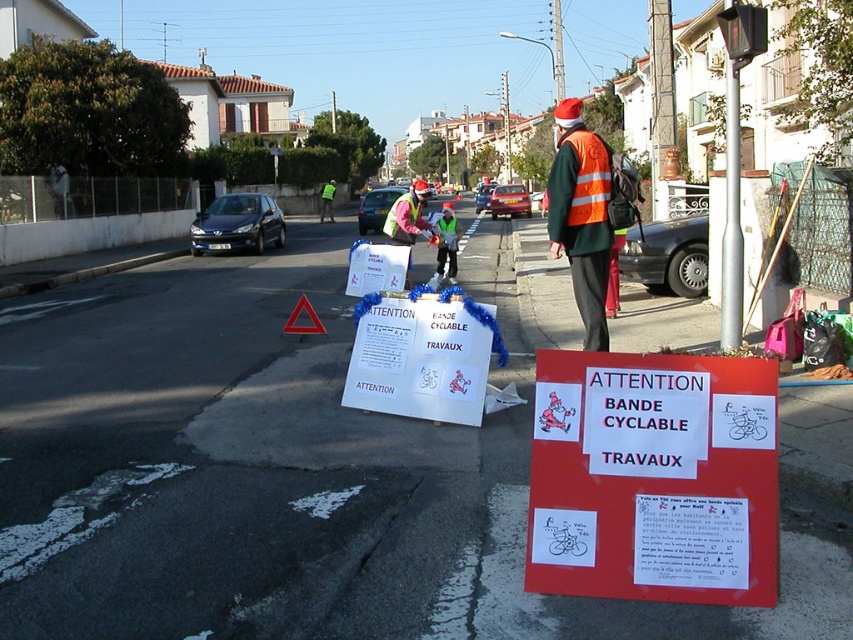
Can you confirm if red matte sign at center is positioned above reflective orange vest at center?

No, red matte sign at center is not above reflective orange vest at center.

Does point (664, 502) come closer to viewer compared to point (573, 168)?

Yes, it is in front of point (573, 168).

Describe the element at coordinates (653, 477) in the screenshot. I see `red matte sign at center` at that location.

Locate an element on the screen. The width and height of the screenshot is (853, 640). red matte sign at center is located at coordinates (653, 477).

Is reflective orange vest at center above reflective yellow safety vest at center?

Yes.

Is reflective orange vest at center behind reflective yellow safety vest at center?

No, reflective orange vest at center is closer to the viewer.

The height and width of the screenshot is (640, 853). In order to click on reflective orange vest at center in this screenshot , I will do [x=581, y=216].

At what (x,y) coordinates should I click in order to perform the action: click on reflective orange vest at center. Please return your answer as a coordinate pair (x, y). This screenshot has height=640, width=853. Looking at the image, I should click on (581, 216).

Can you confirm if red matte sign at center is smaller than reflective yellow safety vest at center?

Indeed, red matte sign at center has a smaller size compared to reflective yellow safety vest at center.

Does red matte sign at center have a lesser height compared to reflective yellow safety vest at center?

Yes, red matte sign at center is shorter than reflective yellow safety vest at center.

Is point (761, 444) farther from camera compared to point (407, 216)?

No, (761, 444) is closer to viewer.

Locate an element on the screen. red matte sign at center is located at coordinates (653, 477).